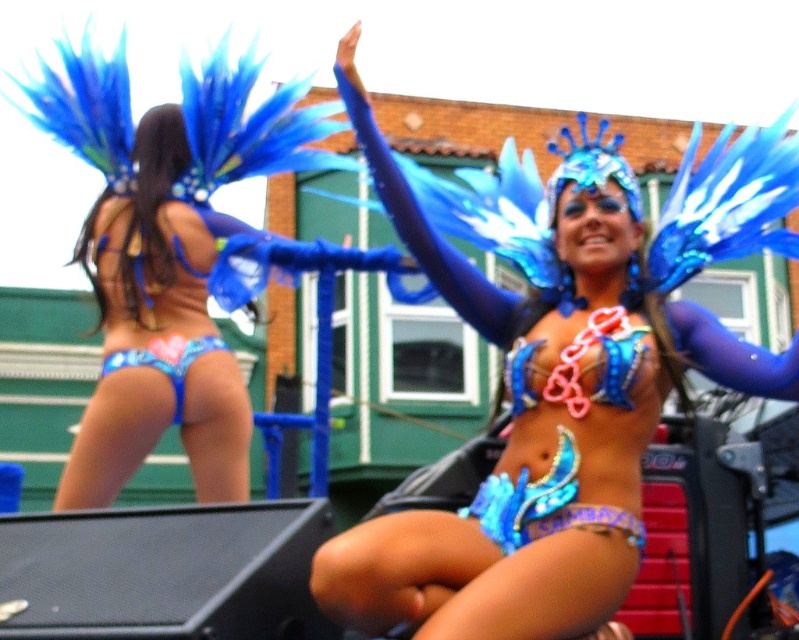
You are a photographer trying to capture both performers in a single frame. Given that the shiny blue costume at center and the blue sequined bikini bottom at lower left are part of the same outfit, which part of the costume would require more space in the frame to ensure it is fully visible?

The shiny blue costume at center requires more space in the frame because its width is larger than the blue sequined bikini bottom at lower left.

You are a photographer at a parade and want to capture both the shiny blue costume at center and the blue sequined bikini bottom at lower left in the same frame. Which costume should you focus on to ensure both are visible without zooming in or out?

The shiny blue costume at center is bigger than the blue sequined bikini bottom at lower left, so focusing on the shiny blue costume at center will ensure both are visible without needing to adjust the zoom.

You are a photographer at a parade and want to capture both the shiny blue costume at center and the blue sequined bikini bottom at lower left in a single frame. Since you can only focus on one subject at a time, which one should you choose to ensure the other remains in the background?

The shiny blue costume at center is in front of the blue sequined bikini bottom at lower left, so you should focus on the shiny blue costume at center to have the blue sequined bikini bottom at lower left in the background.